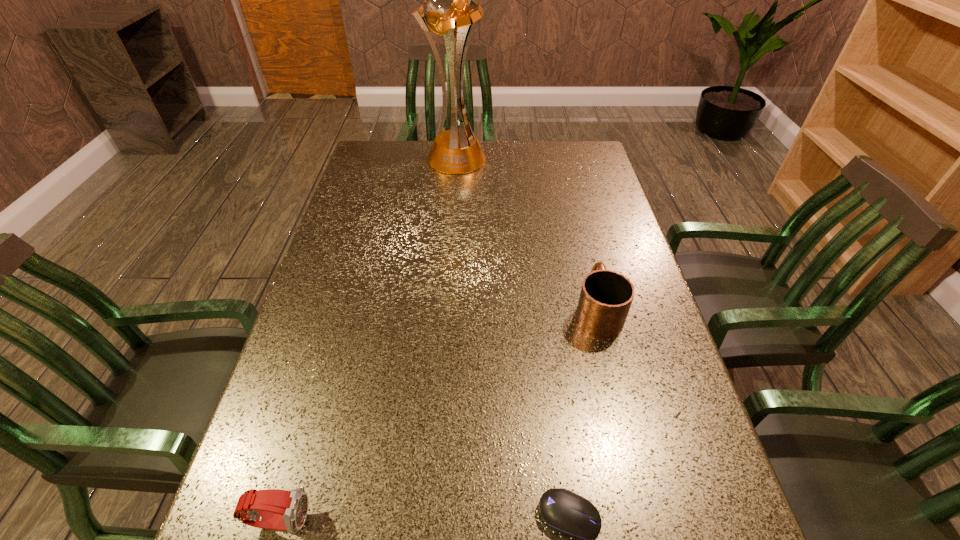
Identify the location of the second object from left to right. Image resolution: width=960 pixels, height=540 pixels. (450, 9).

Where is `the tallest object`? the tallest object is located at coordinates pyautogui.click(x=450, y=9).

Image resolution: width=960 pixels, height=540 pixels. In order to click on the third nearest object in this screenshot , I will do `click(606, 296)`.

Where is `the rightmost object`? The height and width of the screenshot is (540, 960). the rightmost object is located at coordinates (606, 296).

The image size is (960, 540). What are the coordinates of `vacant space situated on the front-facing side of the second object from left to right` in the screenshot? It's located at (450, 227).

Identify the location of free space located 0.390m on the side of the rightmost object with the handle. This screenshot has width=960, height=540. (568, 197).

Where is `vacant space situated on the side of the rightmost object with the handle`? The height and width of the screenshot is (540, 960). vacant space situated on the side of the rightmost object with the handle is located at coordinates (572, 210).

This screenshot has height=540, width=960. Find the location of `vacant area located 0.380m on the side of the rightmost object with the handle`. vacant area located 0.380m on the side of the rightmost object with the handle is located at coordinates (569, 199).

Where is `object that is at the far edge`? The image size is (960, 540). object that is at the far edge is located at coordinates (450, 9).

Locate an element on the screen. This screenshot has height=540, width=960. object located at the right edge is located at coordinates (606, 296).